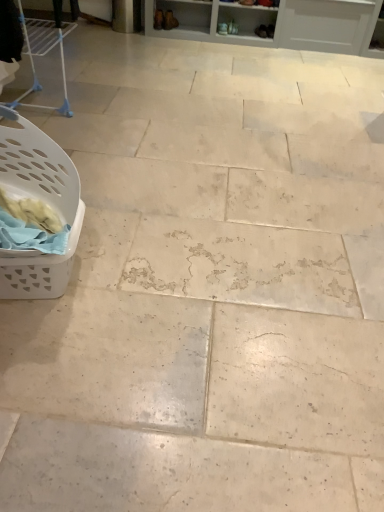
Question: From the image's perspective, is white plastic laundry basket at left over matte brown shoe at upper center, the 1th footwear viewed from the right?

Choices:
 (A) no
 (B) yes

Answer: (A)

Question: From the image's perspective, is white plastic laundry basket at left beneath matte brown shoe at upper center, which is the second footwear from left to right?

Choices:
 (A) no
 (B) yes

Answer: (B)

Question: Is white plastic laundry basket at left taller than matte brown shoe at upper center, which is the second footwear from left to right?

Choices:
 (A) no
 (B) yes

Answer: (B)

Question: From a real-world perspective, is white plastic laundry basket at left located beneath matte brown shoe at upper center, which is the second footwear from left to right?

Choices:
 (A) yes
 (B) no

Answer: (B)

Question: From a real-world perspective, is white plastic laundry basket at left located higher than matte brown shoe at upper center, which is the second footwear from left to right?

Choices:
 (A) yes
 (B) no

Answer: (A)

Question: Does white plastic laundry basket at left lie in front of matte brown shoe at upper center, the 1th footwear viewed from the right?

Choices:
 (A) no
 (B) yes

Answer: (B)

Question: Is matte brown boot at upper center, the second footwear when ordered from right to left, at the back of matte brown shoe at upper center, the 1th footwear viewed from the right?

Choices:
 (A) no
 (B) yes

Answer: (A)

Question: Is matte brown shoe at upper center, the 1th footwear viewed from the right, wider than matte brown boot at upper center, acting as the first footwear starting from the left?

Choices:
 (A) no
 (B) yes

Answer: (A)

Question: Considering the relative sizes of matte brown shoe at upper center, the 1th footwear viewed from the right, and matte brown boot at upper center, the second footwear when ordered from right to left, in the image provided, is matte brown shoe at upper center, the 1th footwear viewed from the right, smaller than matte brown boot at upper center, the second footwear when ordered from right to left,?

Choices:
 (A) no
 (B) yes

Answer: (B)

Question: Considering the relative sizes of matte brown shoe at upper center, which is the second footwear from left to right, and matte brown boot at upper center, acting as the first footwear starting from the left, in the image provided, is matte brown shoe at upper center, which is the second footwear from left to right, shorter than matte brown boot at upper center, acting as the first footwear starting from the left,?

Choices:
 (A) no
 (B) yes

Answer: (B)

Question: From a real-world perspective, is matte brown shoe at upper center, which is the second footwear from left to right, located beneath matte brown boot at upper center, acting as the first footwear starting from the left?

Choices:
 (A) no
 (B) yes

Answer: (B)

Question: Does matte brown shoe at upper center, which is the second footwear from left to right, have a larger size compared to matte brown boot at upper center, the second footwear when ordered from right to left?

Choices:
 (A) yes
 (B) no

Answer: (B)

Question: Is white plastic laundry basket at left to the right of matte brown boot at upper center, the second footwear when ordered from right to left, from the viewer's perspective?

Choices:
 (A) yes
 (B) no

Answer: (B)